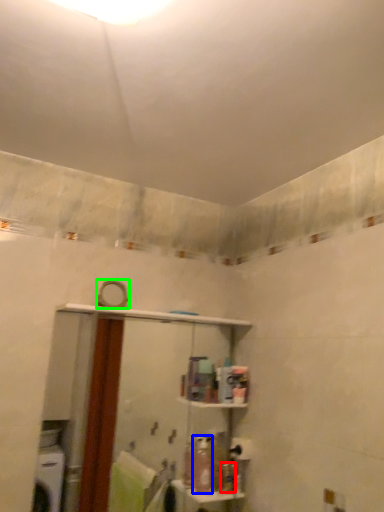
Question: Considering the real-world distances, which object is farthest from toiletry (highlighted by a red box)? toiletry (highlighted by a blue box) or mirror (highlighted by a green box)?

Choices:
 (A) toiletry
 (B) mirror

Answer: (B)